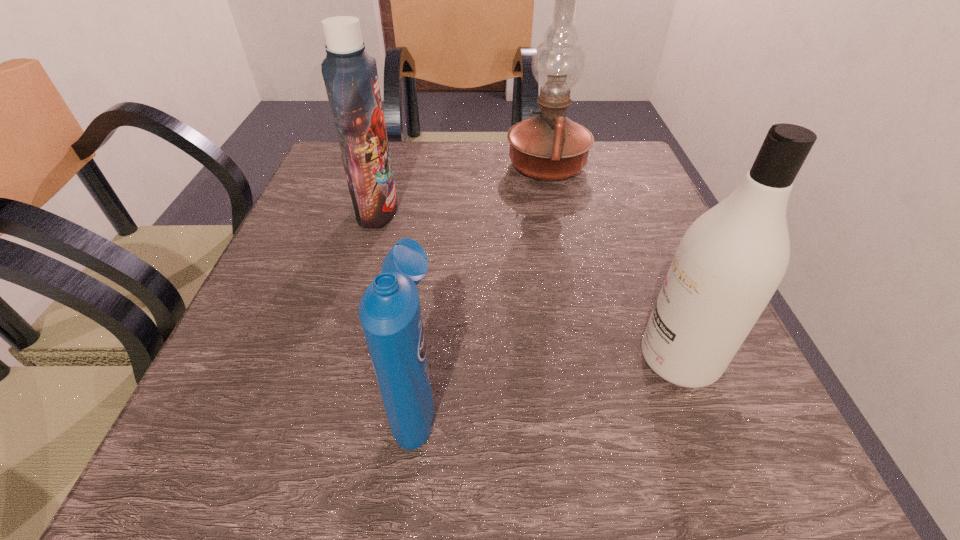
Find the location of `free space located 0.360m on the front-facing side of the rightmost shampoo`. free space located 0.360m on the front-facing side of the rightmost shampoo is located at coordinates (395, 359).

The width and height of the screenshot is (960, 540). I want to click on free space located 0.220m on the back of the second shampoo from left to right, so click(x=433, y=256).

Find the location of a particular element. The image size is (960, 540). oil lamp that is at the far edge is located at coordinates (550, 146).

The image size is (960, 540). In order to click on shampoo that is at the far edge in this screenshot , I will do `click(350, 75)`.

Where is `object present at the near edge`? The image size is (960, 540). object present at the near edge is located at coordinates (390, 313).

Find the location of a particular element. object that is at the left edge is located at coordinates (350, 75).

This screenshot has height=540, width=960. I want to click on oil lamp that is at the right edge, so click(550, 146).

This screenshot has height=540, width=960. What are the coordinates of `shampoo that is at the right edge` in the screenshot? It's located at (729, 263).

At what (x,y) coordinates should I click in order to perform the action: click on object that is positioned at the far left corner. Please return your answer as a coordinate pair (x, y). Looking at the image, I should click on (350, 75).

I want to click on object located at the far right corner, so click(x=550, y=146).